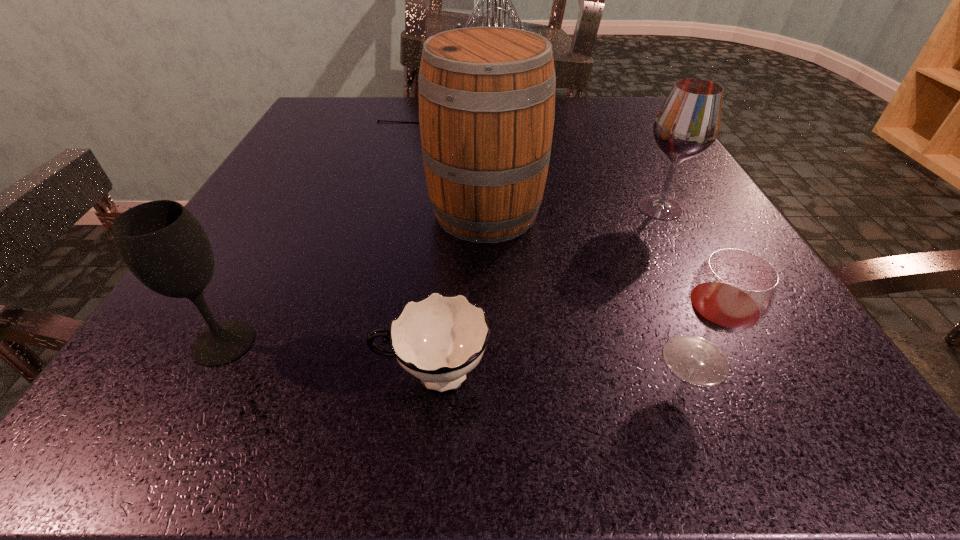
Find the location of `vacant area at the near edge`. vacant area at the near edge is located at coordinates (328, 391).

The width and height of the screenshot is (960, 540). Find the location of `vacant space at the left edge of the desktop`. vacant space at the left edge of the desktop is located at coordinates (239, 236).

I want to click on free space at the right edge, so click(x=795, y=344).

In order to click on free space at the far left corner of the desktop in this screenshot , I will do `click(378, 109)`.

This screenshot has height=540, width=960. I want to click on vacant space at the near left corner of the desktop, so click(x=132, y=381).

The width and height of the screenshot is (960, 540). In the image, there is a desktop. In order to click on vacant region at the far right corner in this screenshot , I will do (x=644, y=125).

Identify the location of vacant area at the near right corner of the desktop. (769, 376).

You are a GUI agent. You are given a task and a screenshot of the screen. Output one action in this format:
    pyautogui.click(x=<x>, y=<y>)
    Task: Click on the free space between the fifth tallest object and the farthest wineglass
    
    Given the screenshot: What is the action you would take?
    pyautogui.click(x=678, y=284)

The image size is (960, 540). I want to click on empty location between the fan and the shortest object, so click(x=441, y=246).

Where is `vacant area that lies between the farthest wineglass and the leftmost object`? The image size is (960, 540). vacant area that lies between the farthest wineglass and the leftmost object is located at coordinates (442, 275).